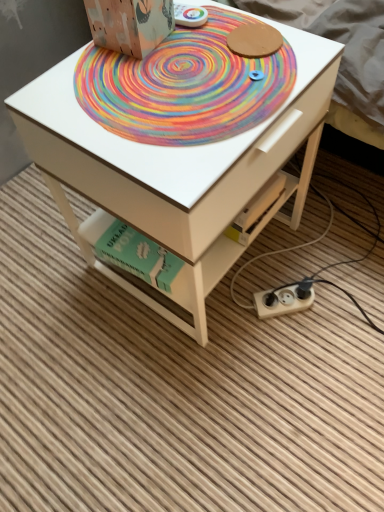
At what (x,y) coordinates should I click in order to perform the action: click on vacant space that is to the left of white matte table at center. Please return your answer as a coordinate pair (x, y). Looking at the image, I should click on (50, 289).